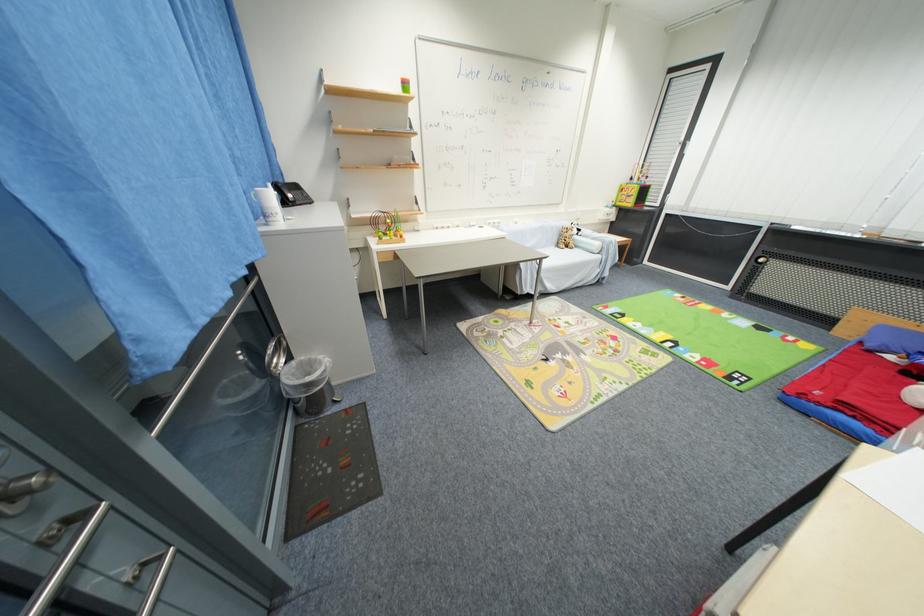
Where is `white mug handle`? This screenshot has height=616, width=924. white mug handle is located at coordinates (269, 205).